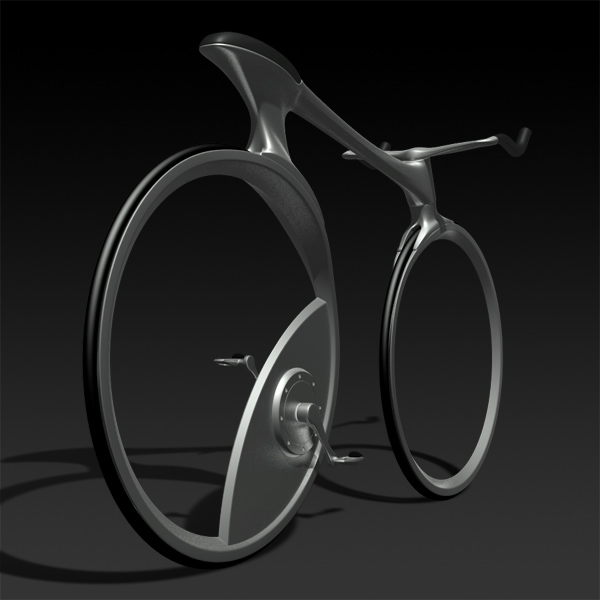
At what (x,y) coordinates should I click in order to perform the action: click on seat. Please return your answer as a coordinate pair (x, y). Image resolution: width=600 pixels, height=600 pixels. Looking at the image, I should click on (258, 48).